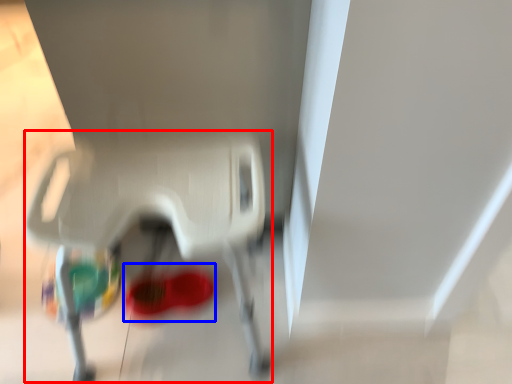
Question: Which object is closer to the camera taking this photo, baby carriage (highlighted by a red box) or footwear (highlighted by a blue box)?

Choices:
 (A) baby carriage
 (B) footwear

Answer: (A)